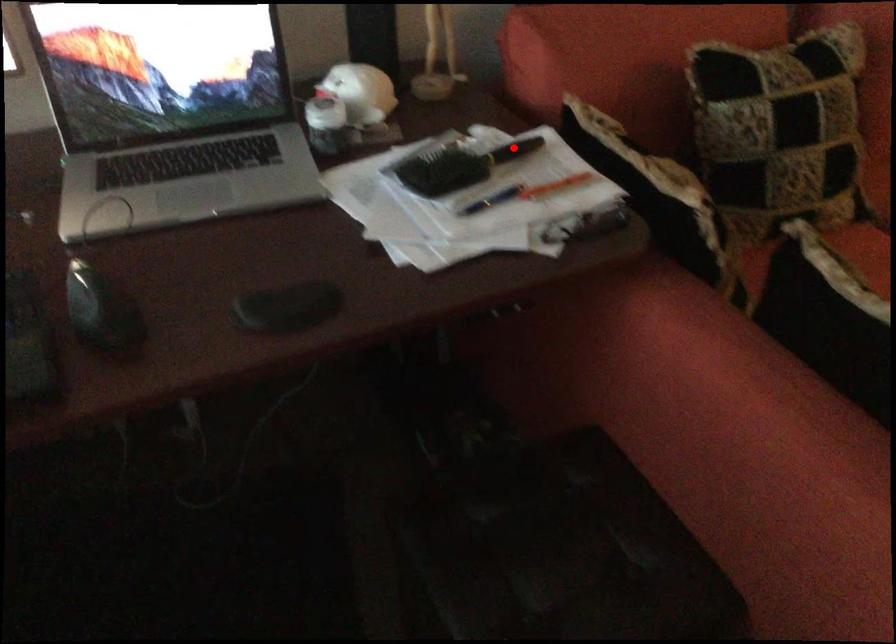
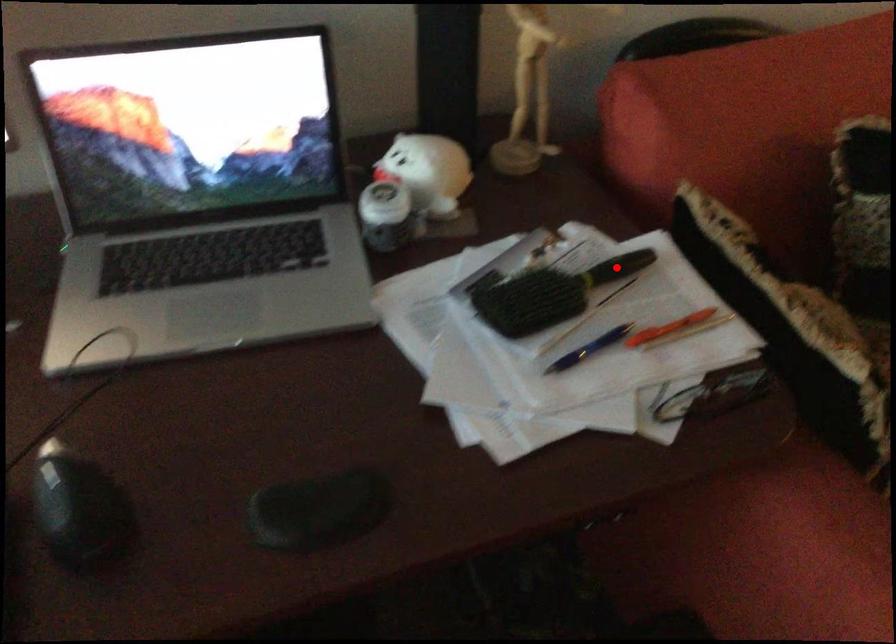
I am providing you with two images of the same scene from different viewpoints. A red point is marked on the first image and another point is marked on the second image. Do the highlighted points in image1 and image2 indicate the same real-world spot?

Yes